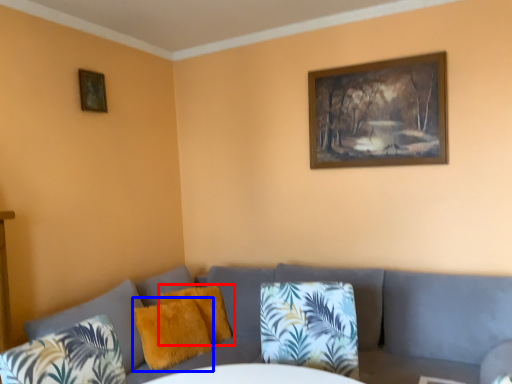
Question: Among these objects, which one is nearest to the camera, pillow (highlighted by a red box) or pillow (highlighted by a blue box)?

Choices:
 (A) pillow
 (B) pillow

Answer: (B)